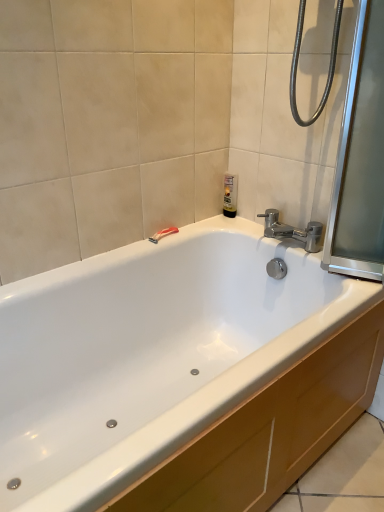
Question: Does transparent glass screen door at right appear on the right side of translucent plastic bottle at upper center?

Choices:
 (A) yes
 (B) no

Answer: (A)

Question: Is transparent glass screen door at right outside translucent plastic bottle at upper center?

Choices:
 (A) no
 (B) yes

Answer: (B)

Question: Considering the relative sizes of transparent glass screen door at right and translucent plastic bottle at upper center in the image provided, is transparent glass screen door at right taller than translucent plastic bottle at upper center?

Choices:
 (A) no
 (B) yes

Answer: (B)

Question: From a real-world perspective, is transparent glass screen door at right positioned under translucent plastic bottle at upper center based on gravity?

Choices:
 (A) yes
 (B) no

Answer: (B)

Question: Is transparent glass screen door at right wider than translucent plastic bottle at upper center?

Choices:
 (A) no
 (B) yes

Answer: (B)

Question: Looking at the image, does red plastic razor at upper center seem bigger or smaller compared to transparent glass screen door at right?

Choices:
 (A) small
 (B) big

Answer: (A)

Question: In terms of height, does red plastic razor at upper center look taller or shorter compared to transparent glass screen door at right?

Choices:
 (A) short
 (B) tall

Answer: (A)

Question: Considering their positions, is red plastic razor at upper center located in front of or behind transparent glass screen door at right?

Choices:
 (A) behind
 (B) front

Answer: (A)

Question: From the image's perspective, is red plastic razor at upper center above or below transparent glass screen door at right?

Choices:
 (A) below
 (B) above

Answer: (A)

Question: From a real-world perspective, is transparent glass screen door at right above or below red plastic razor at upper center?

Choices:
 (A) above
 (B) below

Answer: (A)

Question: In terms of width, does transparent glass screen door at right look wider or thinner when compared to red plastic razor at upper center?

Choices:
 (A) thin
 (B) wide

Answer: (B)

Question: Considering the relative positions of transparent glass screen door at right and red plastic razor at upper center in the image provided, is transparent glass screen door at right to the left or to the right of red plastic razor at upper center?

Choices:
 (A) left
 (B) right

Answer: (B)

Question: Is transparent glass screen door at right taller or shorter than red plastic razor at upper center?

Choices:
 (A) short
 (B) tall

Answer: (B)

Question: In terms of size, does polished chrome faucet at upper right appear bigger or smaller than translucent plastic bottle at upper center?

Choices:
 (A) big
 (B) small

Answer: (A)

Question: From a real-world perspective, is polished chrome faucet at upper right positioned above or below translucent plastic bottle at upper center?

Choices:
 (A) below
 (B) above

Answer: (A)